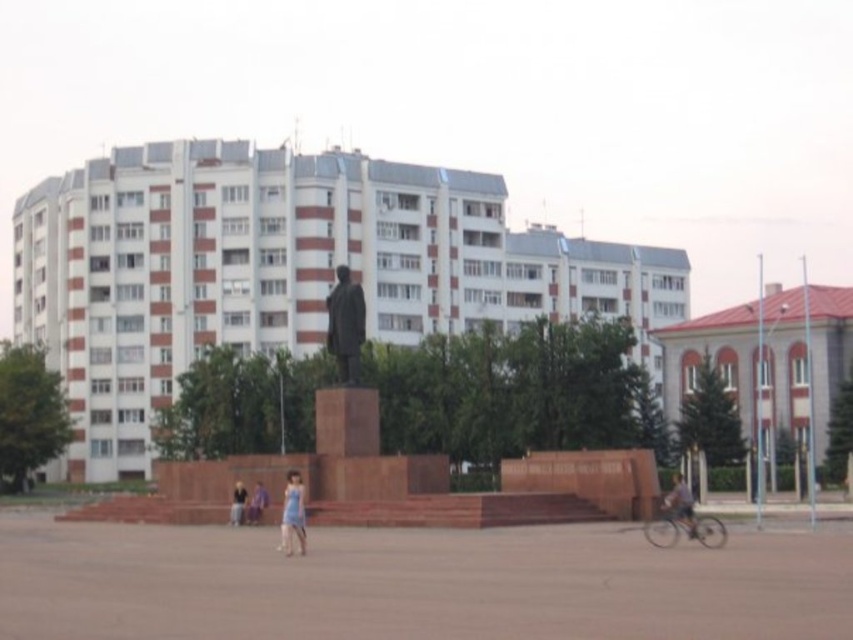
Question: Among these points, which one is farthest from the camera?

Choices:
 (A) (299, 531)
 (B) (252, 509)

Answer: (B)

Question: Is blue fabric dress at lower center above blue dress at center?

Choices:
 (A) no
 (B) yes

Answer: (B)

Question: Which object is positioned closest to the light blue dress at center?

Choices:
 (A) bronze statue at center
 (B) blue fabric dress at lower center
 (C) blue dress at center
 (D) blue denim shorts at lower right

Answer: (C)

Question: Does bronze statue at center appear on the left side of blue dress at center?

Choices:
 (A) no
 (B) yes

Answer: (B)

Question: Does blue fabric dress at lower center appear over blue denim shorts at lower right?

Choices:
 (A) no
 (B) yes

Answer: (B)

Question: Among these objects, which one is nearest to the camera?

Choices:
 (A) bronze statue at center
 (B) blue denim shorts at lower right

Answer: (B)